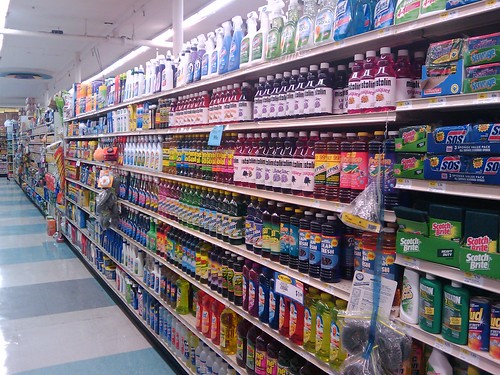
Locate an element on the screen. The width and height of the screenshot is (500, 375). white floor tiles is located at coordinates (102, 339), (61, 268), (33, 234), (20, 217), (14, 201), (7, 189).